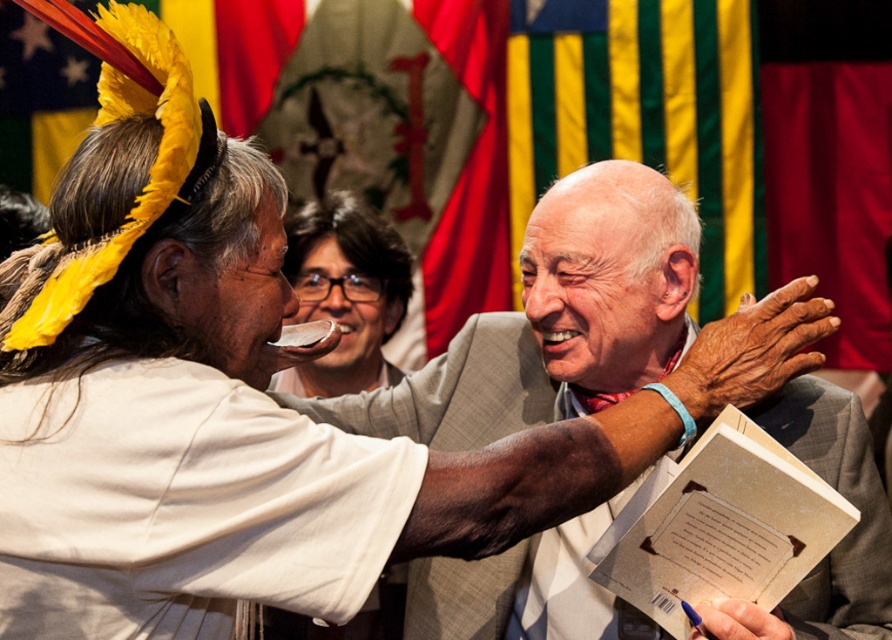
Does silky fabric flag at upper center appear on the right side of matte black glasses at center?

Yes, silky fabric flag at upper center is to the right of matte black glasses at center.

Can you confirm if silky fabric flag at upper center is thinner than matte black glasses at center?

Incorrect, silky fabric flag at upper center's width is not less than matte black glasses at center's.

What do you see at coordinates (389, 131) in the screenshot? I see `silky fabric flag at upper center` at bounding box center [389, 131].

Where is `silky fabric flag at upper center`? The image size is (892, 640). silky fabric flag at upper center is located at coordinates (389, 131).

Looking at this image, does light gray suit at center lie behind silky fabric flag at upper center?

No.

Is light gray suit at center taller than silky fabric flag at upper center?

No.

Is point (596, 608) positioned before point (485, 285)?

Yes, point (596, 608) is closer to viewer.

Find the location of a particular element. The width and height of the screenshot is (892, 640). light gray suit at center is located at coordinates (555, 321).

Does silky fabric flag at upper center have a lesser height compared to beige paper book at lower right?

Incorrect, silky fabric flag at upper center's height does not fall short of beige paper book at lower right's.

Is point (446, 339) positioned before point (690, 566)?

No, it is behind (690, 566).

Who is more forward, (480,234) or (646,506)?

Positioned in front is point (646,506).

What are the coordinates of `silky fabric flag at upper center` in the screenshot? It's located at (389, 131).